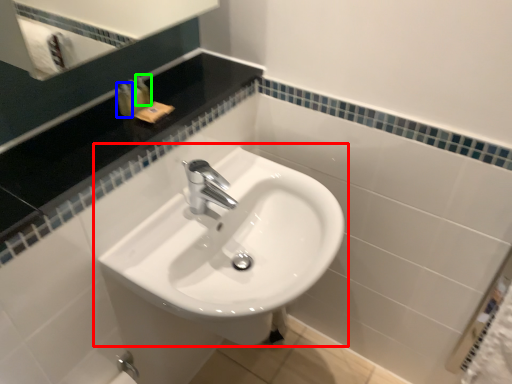
Question: Which is farther away from sink (highlighted by a red box)? toiletry (highlighted by a blue box) or toiletry (highlighted by a green box)?

Choices:
 (A) toiletry
 (B) toiletry

Answer: (B)